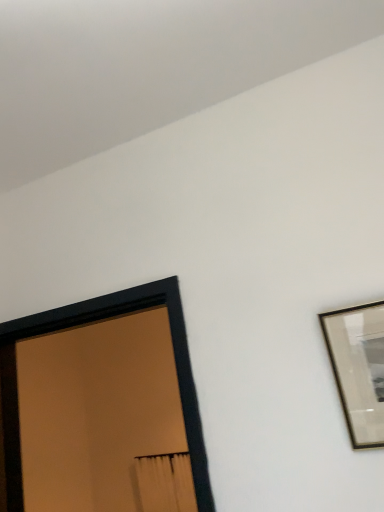
Question: Is gold metallic picture frame at upper right, placed as the 1th picture frame when sorted from front to back, smaller than black matte picture frame at left, arranged as the first picture frame when viewed from the back?

Choices:
 (A) no
 (B) yes

Answer: (B)

Question: Does gold metallic picture frame at upper right, the second picture frame positioned from the back, contain black matte picture frame at left, arranged as the first picture frame when viewed from the back?

Choices:
 (A) no
 (B) yes

Answer: (A)

Question: Can we say gold metallic picture frame at upper right, which is the first picture frame from right to left, lies outside black matte picture frame at left, which is counted as the second picture frame, starting from the front?

Choices:
 (A) yes
 (B) no

Answer: (A)

Question: Can you confirm if gold metallic picture frame at upper right, which is the second picture frame from left to right, is positioned to the right of black matte picture frame at left, the 2th picture frame positioned from the right?

Choices:
 (A) no
 (B) yes

Answer: (B)

Question: Is gold metallic picture frame at upper right, which is the second picture frame from left to right, at the left side of black matte picture frame at left, marked as the first picture frame in a left-to-right arrangement?

Choices:
 (A) no
 (B) yes

Answer: (A)

Question: Is the depth of gold metallic picture frame at upper right, which is the first picture frame from right to left, greater than that of black matte picture frame at left, the 2th picture frame positioned from the right?

Choices:
 (A) no
 (B) yes

Answer: (A)

Question: From the image's perspective, does black matte picture frame at left, which is counted as the second picture frame, starting from the front, appear higher than gold metallic picture frame at upper right, which is the second picture frame from left to right?

Choices:
 (A) yes
 (B) no

Answer: (B)

Question: Does black matte picture frame at left, the 2th picture frame positioned from the right, have a smaller size compared to gold metallic picture frame at upper right, which is the second picture frame from left to right?

Choices:
 (A) no
 (B) yes

Answer: (A)

Question: Is black matte picture frame at left, the 2th picture frame positioned from the right, not inside gold metallic picture frame at upper right, placed as the 1th picture frame when sorted from front to back?

Choices:
 (A) yes
 (B) no

Answer: (A)

Question: Considering the relative sizes of black matte picture frame at left, which is counted as the second picture frame, starting from the front, and gold metallic picture frame at upper right, the second picture frame positioned from the back, in the image provided, is black matte picture frame at left, which is counted as the second picture frame, starting from the front, taller than gold metallic picture frame at upper right, the second picture frame positioned from the back,?

Choices:
 (A) yes
 (B) no

Answer: (A)

Question: Is the depth of black matte picture frame at left, which is counted as the second picture frame, starting from the front, greater than that of gold metallic picture frame at upper right, placed as the 1th picture frame when sorted from front to back?

Choices:
 (A) no
 (B) yes

Answer: (B)

Question: Can you confirm if black matte picture frame at left, arranged as the first picture frame when viewed from the back, is positioned to the right of gold metallic picture frame at upper right, placed as the 1th picture frame when sorted from front to back?

Choices:
 (A) no
 (B) yes

Answer: (A)

Question: Would you say gold metallic picture frame at upper right, which is the second picture frame from left to right, is to the left or to the right of black matte picture frame at left, marked as the first picture frame in a left-to-right arrangement, in the picture?

Choices:
 (A) left
 (B) right

Answer: (B)